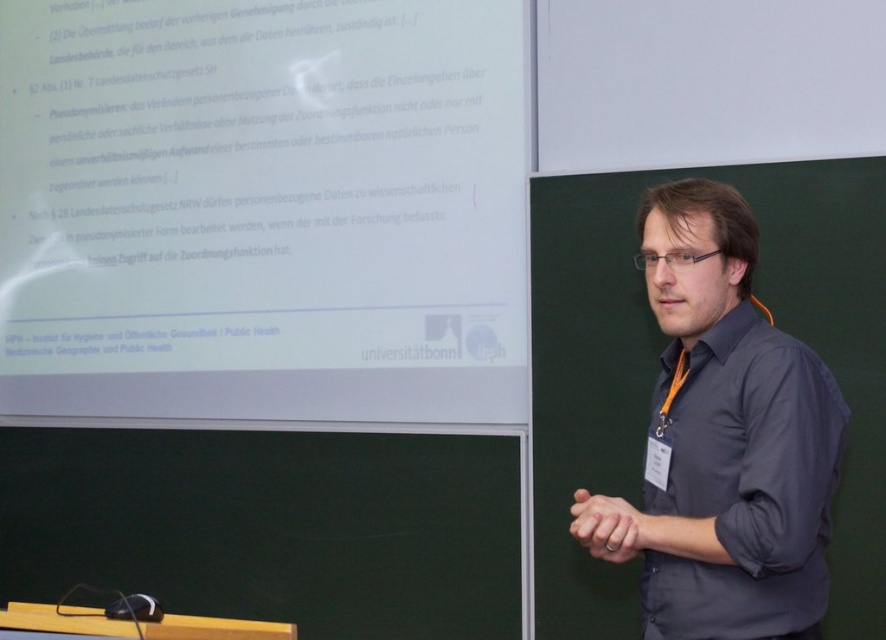
Question: Does white paper at upper center have a smaller size compared to dark gray shirt at center?

Choices:
 (A) no
 (B) yes

Answer: (A)

Question: Which object appears farthest from the camera in this image?

Choices:
 (A) dark gray shirt at center
 (B) white paper at upper center

Answer: (B)

Question: Can you confirm if white paper at upper center is smaller than dark gray shirt at center?

Choices:
 (A) no
 (B) yes

Answer: (A)

Question: Which object is farther from the camera taking this photo?

Choices:
 (A) white paper at upper center
 (B) dark gray shirt at center

Answer: (A)

Question: Observing the image, what is the correct spatial positioning of white paper at upper center in reference to dark gray shirt at center?

Choices:
 (A) right
 (B) left

Answer: (B)